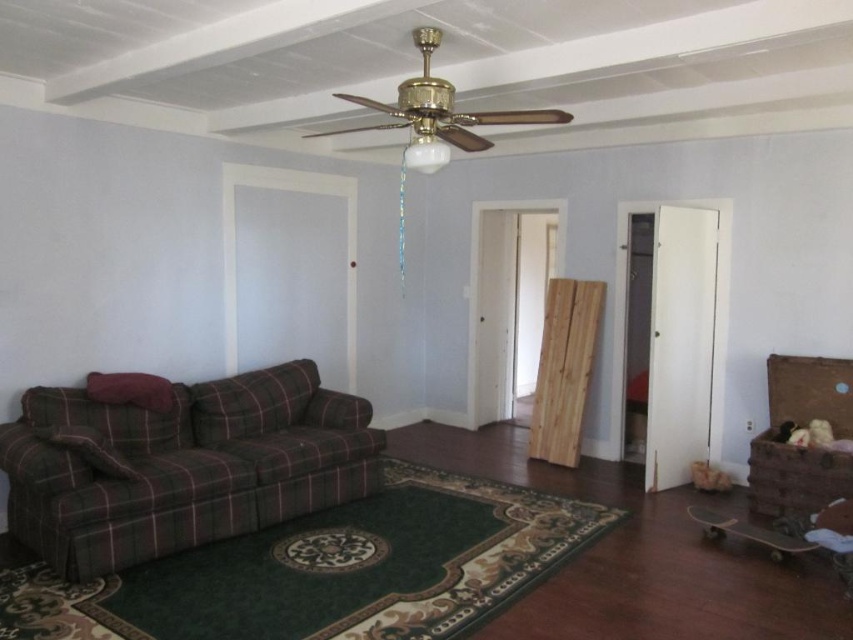
You are standing at the entrance of the living room and want to sit on the plaid fabric couch at lower left. According to the coordinates provided, where should you walk towards?

The plaid fabric couch at lower left is located at coordinates point (180, 465), so you should walk towards that point to reach it.